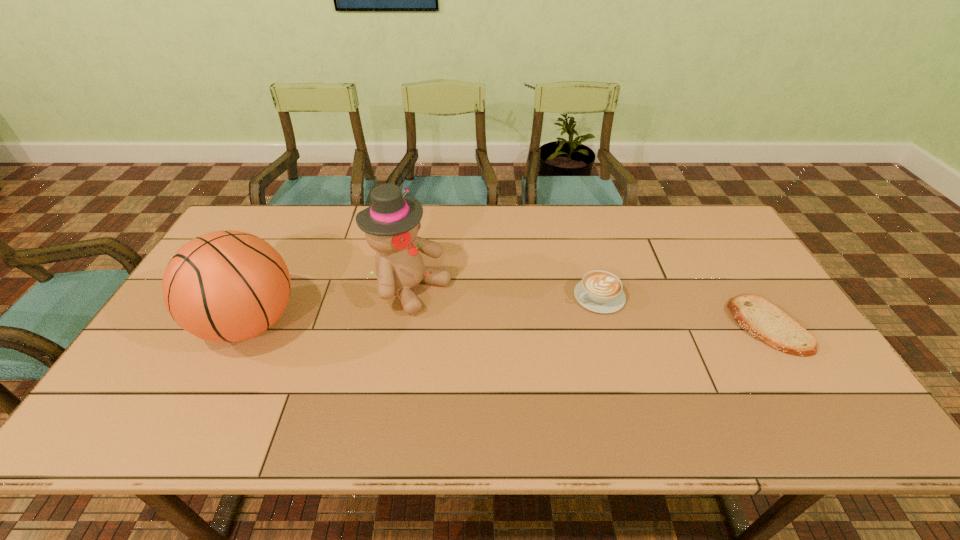
Identify the location of basketball. (227, 286).

Locate an element on the screen. This screenshot has width=960, height=540. pita bread is located at coordinates 764,321.

What are the coordinates of `the shortest object` in the screenshot? It's located at (764, 321).

The height and width of the screenshot is (540, 960). Identify the location of the third tallest object. (600, 291).

Where is `the third object from left to right`? This screenshot has width=960, height=540. the third object from left to right is located at coordinates (600, 291).

The image size is (960, 540). In order to click on rag_doll in this screenshot , I will do `click(391, 224)`.

In order to click on vacant space located on the back of the basketball in this screenshot , I will do `click(278, 267)`.

Where is `vacant space located on the left of the rightmost object`? This screenshot has height=540, width=960. vacant space located on the left of the rightmost object is located at coordinates (698, 326).

Identify the location of free space located 0.230m on the side of the second shortest object with the handle. This screenshot has width=960, height=540. (512, 340).

Locate an element on the screen. This screenshot has height=540, width=960. vacant area located on the side of the second shortest object with the handle is located at coordinates (537, 328).